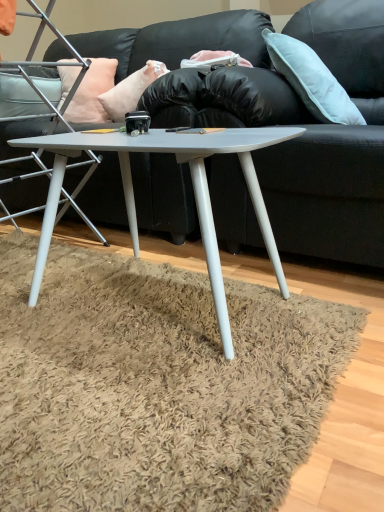
Question: Does pink fabric pillow at upper left, the 2th pillow positioned from the right, turn towards metallic silver chair at left?

Choices:
 (A) yes
 (B) no

Answer: (A)

Question: Can you confirm if pink fabric pillow at upper left, the second pillow from the left, is wider than metallic silver chair at left?

Choices:
 (A) yes
 (B) no

Answer: (B)

Question: From the image's perspective, is pink fabric pillow at upper left, the 2th pillow positioned from the right, located above metallic silver chair at left?

Choices:
 (A) yes
 (B) no

Answer: (A)

Question: Considering the relative sizes of pink fabric pillow at upper left, the second pillow from the left, and metallic silver chair at left in the image provided, is pink fabric pillow at upper left, the second pillow from the left, taller than metallic silver chair at left?

Choices:
 (A) no
 (B) yes

Answer: (A)

Question: Is pink fabric pillow at upper left, the second pillow from the left, positioned far away from metallic silver chair at left?

Choices:
 (A) yes
 (B) no

Answer: (B)

Question: Does pink fabric pillow at upper left, the 2th pillow positioned from the right, have a lesser width compared to metallic silver chair at left?

Choices:
 (A) yes
 (B) no

Answer: (A)

Question: From a real-world perspective, is pink fabric pillow at upper left, the second pillow from the left, located higher than matte gray coffee table at center?

Choices:
 (A) yes
 (B) no

Answer: (A)

Question: Can you confirm if pink fabric pillow at upper left, the second pillow from the left, is wider than matte gray coffee table at center?

Choices:
 (A) yes
 (B) no

Answer: (B)

Question: Is pink fabric pillow at upper left, the second pillow from the left, positioned far away from matte gray coffee table at center?

Choices:
 (A) no
 (B) yes

Answer: (A)

Question: Is pink fabric pillow at upper left, the 2th pillow positioned from the right, taller than matte gray coffee table at center?

Choices:
 (A) yes
 (B) no

Answer: (B)

Question: Considering the relative sizes of pink fabric pillow at upper left, the 2th pillow positioned from the right, and matte gray coffee table at center in the image provided, is pink fabric pillow at upper left, the 2th pillow positioned from the right, bigger than matte gray coffee table at center?

Choices:
 (A) no
 (B) yes

Answer: (A)

Question: Is pink fabric pillow at upper left, the 2th pillow positioned from the right, smaller than matte gray coffee table at center?

Choices:
 (A) no
 (B) yes

Answer: (B)

Question: From a real-world perspective, is light blue fabric pillow at upper right, which is counted as the third pillow, starting from the left, below peachy fabric pillow at upper left, the third pillow when ordered from right to left?

Choices:
 (A) yes
 (B) no

Answer: (B)